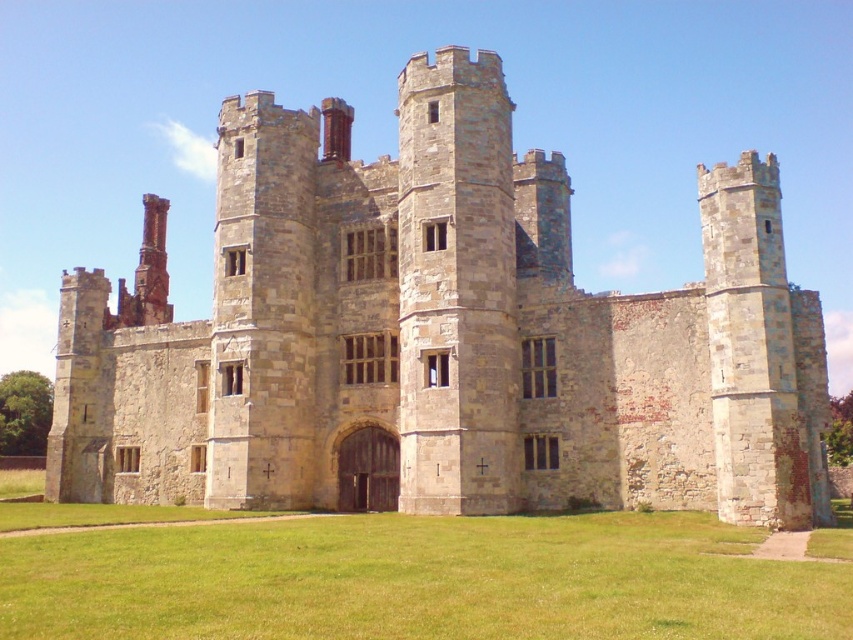
Question: Which object is closer to the camera taking this photo?

Choices:
 (A) stone castle at center
 (B) green grass at center

Answer: (B)

Question: Can you confirm if stone castle at center is positioned below green grass at center?

Choices:
 (A) yes
 (B) no

Answer: (B)

Question: Which point is farther from the camera taking this photo?

Choices:
 (A) (532, 349)
 (B) (178, 572)

Answer: (A)

Question: Can you confirm if stone castle at center is wider than green grass at center?

Choices:
 (A) no
 (B) yes

Answer: (B)

Question: Can you confirm if stone castle at center is positioned to the left of green grass at center?

Choices:
 (A) no
 (B) yes

Answer: (B)